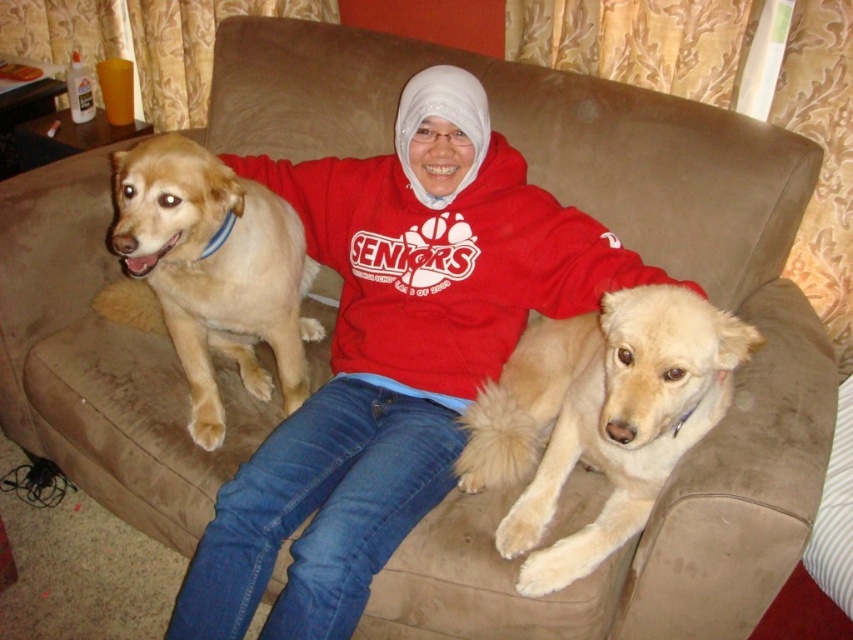
Question: Is fuzzy beige dog at center positioned in front of golden fur dog at left?

Choices:
 (A) no
 (B) yes

Answer: (B)

Question: Which point is farther from the camera taking this photo?

Choices:
 (A) (294, 269)
 (B) (593, 342)

Answer: (A)

Question: Is fuzzy beige dog at center smaller than golden fur dog at left?

Choices:
 (A) no
 (B) yes

Answer: (B)

Question: Which point is farther to the camera?

Choices:
 (A) (518, 397)
 (B) (283, 248)

Answer: (B)

Question: Which point is farther from the camera taking this photo?

Choices:
 (A) (131, 154)
 (B) (706, 422)

Answer: (A)

Question: Observing the image, what is the correct spatial positioning of fuzzy beige dog at center in reference to golden fur dog at left?

Choices:
 (A) above
 (B) below

Answer: (B)